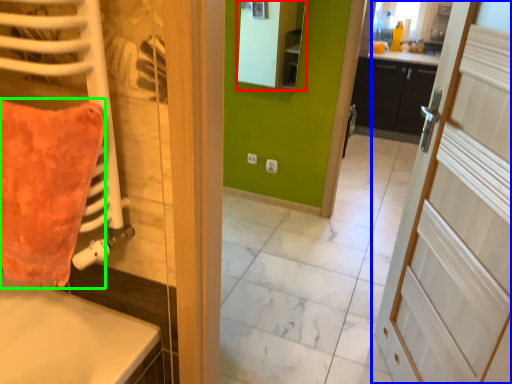
Question: Which is farther away from mirror (highlighted by a red box)? door (highlighted by a blue box) or throw pillow (highlighted by a green box)?

Choices:
 (A) door
 (B) throw pillow

Answer: (B)